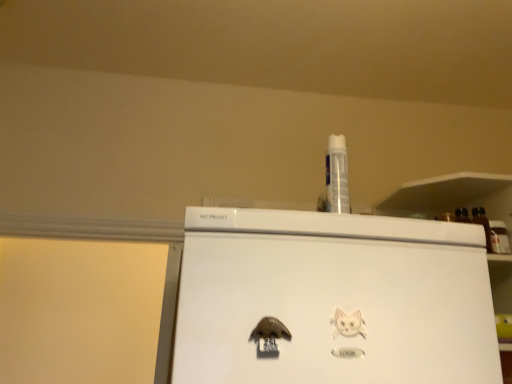
This screenshot has width=512, height=384. In order to click on white paper cat at lower right, which ranks as the 2th animal in left-to-right order in this screenshot , I will do `click(348, 323)`.

Image resolution: width=512 pixels, height=384 pixels. Describe the element at coordinates (348, 323) in the screenshot. I see `white paper cat at lower right, which is the first animal from right to left` at that location.

The height and width of the screenshot is (384, 512). What do you see at coordinates (269, 336) in the screenshot?
I see `brown matte magnet at lower center, acting as the second animal starting from the right` at bounding box center [269, 336].

At what (x,y) coordinates should I click in order to perform the action: click on brown matte magnet at lower center, acting as the second animal starting from the right. Please return your answer as a coordinate pair (x, y). This screenshot has width=512, height=384. Looking at the image, I should click on [269, 336].

Find the location of a particular element. The width and height of the screenshot is (512, 384). white paper cat at lower right, which is the first animal from right to left is located at coordinates (348, 323).

Which object is positioned more to the left, white paper cat at lower right, which is the first animal from right to left, or brown matte magnet at lower center, acting as the second animal starting from the right?

Positioned to the left is brown matte magnet at lower center, acting as the second animal starting from the right.

Which object is closer to the camera, white paper cat at lower right, which is the first animal from right to left, or brown matte magnet at lower center, acting as the second animal starting from the right?

Positioned in front is brown matte magnet at lower center, acting as the second animal starting from the right.

Which point is more distant from viewer, (339, 323) or (285, 328)?

Point (339, 323)

From the image's perspective, which is above, white paper cat at lower right, which ranks as the 2th animal in left-to-right order, or brown matte magnet at lower center, which is counted as the 1th animal, starting from the left?

From the image's view, white paper cat at lower right, which ranks as the 2th animal in left-to-right order, is above.

Looking at this image, from a real-world perspective, is white paper cat at lower right, which ranks as the 2th animal in left-to-right order, physically above brown matte magnet at lower center, acting as the second animal starting from the right?

Indeed, from a real-world perspective, white paper cat at lower right, which ranks as the 2th animal in left-to-right order, stands above brown matte magnet at lower center, acting as the second animal starting from the right.

Consider the image. Considering the sizes of white paper cat at lower right, which ranks as the 2th animal in left-to-right order, and brown matte magnet at lower center, which is counted as the 1th animal, starting from the left, in the image, is white paper cat at lower right, which ranks as the 2th animal in left-to-right order, wider or thinner than brown matte magnet at lower center, which is counted as the 1th animal, starting from the left,?

Considering their sizes, white paper cat at lower right, which ranks as the 2th animal in left-to-right order, looks slimmer than brown matte magnet at lower center, which is counted as the 1th animal, starting from the left.

Looking at this image, between white paper cat at lower right, which is the first animal from right to left, and brown matte magnet at lower center, which is counted as the 1th animal, starting from the left, which one has more height?

Standing taller between the two is brown matte magnet at lower center, which is counted as the 1th animal, starting from the left.

Considering the sizes of objects white paper cat at lower right, which is the first animal from right to left, and brown matte magnet at lower center, acting as the second animal starting from the right, in the image provided, who is bigger, white paper cat at lower right, which is the first animal from right to left, or brown matte magnet at lower center, acting as the second animal starting from the right,?

brown matte magnet at lower center, acting as the second animal starting from the right.

Would you say white paper cat at lower right, which ranks as the 2th animal in left-to-right order, contains brown matte magnet at lower center, which is counted as the 1th animal, starting from the left?

No, white paper cat at lower right, which ranks as the 2th animal in left-to-right order, does not contain brown matte magnet at lower center, which is counted as the 1th animal, starting from the left.

Is the surface of white paper cat at lower right, which is the first animal from right to left, in direct contact with brown matte magnet at lower center, which is counted as the 1th animal, starting from the left?

white paper cat at lower right, which is the first animal from right to left, is not next to brown matte magnet at lower center, which is counted as the 1th animal, starting from the left, and they're not touching.

Is white paper cat at lower right, which ranks as the 2th animal in left-to-right order, aimed at brown matte magnet at lower center, acting as the second animal starting from the right?

No, white paper cat at lower right, which ranks as the 2th animal in left-to-right order, is not oriented towards brown matte magnet at lower center, acting as the second animal starting from the right.

Image resolution: width=512 pixels, height=384 pixels. In order to click on animal below the white paper cat at lower right, which is the first animal from right to left (from a real-world perspective) in this screenshot , I will do click(x=269, y=336).

Between brown matte magnet at lower center, acting as the second animal starting from the right, and white paper cat at lower right, which is the first animal from right to left, which one appears on the right side from the viewer's perspective?

white paper cat at lower right, which is the first animal from right to left.

Which object is closer to the camera, brown matte magnet at lower center, which is counted as the 1th animal, starting from the left, or white paper cat at lower right, which ranks as the 2th animal in left-to-right order?

brown matte magnet at lower center, which is counted as the 1th animal, starting from the left.

Which point is more forward, (257, 327) or (351, 313)?

The point (257, 327) is more forward.

From the image's perspective, who appears lower, brown matte magnet at lower center, which is counted as the 1th animal, starting from the left, or white paper cat at lower right, which ranks as the 2th animal in left-to-right order?

brown matte magnet at lower center, which is counted as the 1th animal, starting from the left, appears lower in the image.

From a real-world perspective, is brown matte magnet at lower center, acting as the second animal starting from the right, positioned over white paper cat at lower right, which is the first animal from right to left, based on gravity?

No, from a real-world perspective, brown matte magnet at lower center, acting as the second animal starting from the right, is not on top of white paper cat at lower right, which is the first animal from right to left.

Considering the sizes of brown matte magnet at lower center, which is counted as the 1th animal, starting from the left, and white paper cat at lower right, which ranks as the 2th animal in left-to-right order, in the image, is brown matte magnet at lower center, which is counted as the 1th animal, starting from the left, wider or thinner than white paper cat at lower right, which ranks as the 2th animal in left-to-right order,?

Considering their sizes, brown matte magnet at lower center, which is counted as the 1th animal, starting from the left, looks broader than white paper cat at lower right, which ranks as the 2th animal in left-to-right order.

Who is taller, brown matte magnet at lower center, which is counted as the 1th animal, starting from the left, or white paper cat at lower right, which ranks as the 2th animal in left-to-right order?

brown matte magnet at lower center, which is counted as the 1th animal, starting from the left.

Can you confirm if brown matte magnet at lower center, acting as the second animal starting from the right, is bigger than white paper cat at lower right, which is the first animal from right to left?

Indeed, brown matte magnet at lower center, acting as the second animal starting from the right, has a larger size compared to white paper cat at lower right, which is the first animal from right to left.

Is brown matte magnet at lower center, acting as the second animal starting from the right, situated inside white paper cat at lower right, which ranks as the 2th animal in left-to-right order, or outside?

brown matte magnet at lower center, acting as the second animal starting from the right, lies outside white paper cat at lower right, which ranks as the 2th animal in left-to-right order.

Is brown matte magnet at lower center, which is counted as the 1th animal, starting from the left, directly adjacent to white paper cat at lower right, which ranks as the 2th animal in left-to-right order?

They are not placed beside each other.

Is brown matte magnet at lower center, acting as the second animal starting from the right, looking in the opposite direction of white paper cat at lower right, which ranks as the 2th animal in left-to-right order?

No.

What's the angular difference between brown matte magnet at lower center, which is counted as the 1th animal, starting from the left, and white paper cat at lower right, which ranks as the 2th animal in left-to-right order,'s facing directions?

The angular difference between brown matte magnet at lower center, which is counted as the 1th animal, starting from the left, and white paper cat at lower right, which ranks as the 2th animal in left-to-right order, is 1.45 degrees.

Measure the distance between brown matte magnet at lower center, acting as the second animal starting from the right, and white paper cat at lower right, which is the first animal from right to left.

brown matte magnet at lower center, acting as the second animal starting from the right, and white paper cat at lower right, which is the first animal from right to left, are 11.40 centimeters apart.

Where is `animal that appears on the left of white paper cat at lower right, which is the first animal from right to left`? animal that appears on the left of white paper cat at lower right, which is the first animal from right to left is located at coordinates (269, 336).

Find the location of a particular element. animal in front of the white paper cat at lower right, which is the first animal from right to left is located at coordinates (269, 336).

You are a GUI agent. You are given a task and a screenshot of the screen. Output one action in this format:
    pyautogui.click(x=<x>, y=<y>)
    Task: Click on the animal on the right of brown matte magnet at lower center, which is counted as the 1th animal, starting from the left
    This screenshot has width=512, height=384.
    Given the screenshot: What is the action you would take?
    pyautogui.click(x=348, y=323)